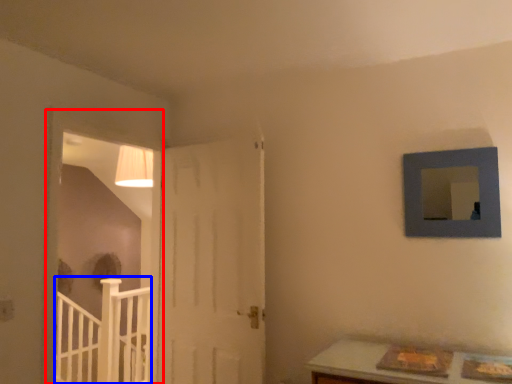
Question: Which point is closer to the camera, window frame (highlighted by a red box) or rail (highlighted by a blue box)?

Choices:
 (A) window frame
 (B) rail

Answer: (A)